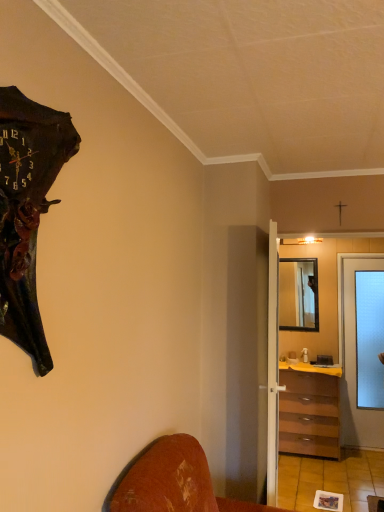
Question: Is transparent frosted glass screen door at center-right oriented towards wooden framed mirror at center?

Choices:
 (A) yes
 (B) no

Answer: (A)

Question: Would you say wooden framed mirror at center is part of transparent frosted glass screen door at center-right's contents?

Choices:
 (A) no
 (B) yes

Answer: (A)

Question: From the image's perspective, would you say transparent frosted glass screen door at center-right is positioned over wooden framed mirror at center?

Choices:
 (A) no
 (B) yes

Answer: (A)

Question: Can you confirm if transparent frosted glass screen door at center-right is thinner than wooden framed mirror at center?

Choices:
 (A) yes
 (B) no

Answer: (B)

Question: From a real-world perspective, does transparent frosted glass screen door at center-right sit lower than wooden framed mirror at center?

Choices:
 (A) no
 (B) yes

Answer: (B)

Question: Would you say yellow laminate counter top at center is to the left or to the right of brown wooden chest of drawers at center-right in the picture?

Choices:
 (A) left
 (B) right

Answer: (B)

Question: From a real-world perspective, relative to brown wooden chest of drawers at center-right, is yellow laminate counter top at center vertically above or below?

Choices:
 (A) below
 (B) above

Answer: (B)

Question: Considering the positions of yellow laminate counter top at center and brown wooden chest of drawers at center-right in the image, is yellow laminate counter top at center wider or thinner than brown wooden chest of drawers at center-right?

Choices:
 (A) thin
 (B) wide

Answer: (B)

Question: Does point (327, 369) appear closer or farther from the camera than point (337, 377)?

Choices:
 (A) closer
 (B) farther

Answer: (B)

Question: From a real-world perspective, is transparent glass door at right, acting as the first door starting from the right, positioned above or below dark brown wooden wall clock at left?

Choices:
 (A) above
 (B) below

Answer: (B)

Question: Would you say transparent glass door at right, acting as the first door starting from the right, is inside or outside dark brown wooden wall clock at left?

Choices:
 (A) outside
 (B) inside

Answer: (A)

Question: Is transparent glass door at right, the 1th door when ordered from back to front, to the left or to the right of dark brown wooden wall clock at left in the image?

Choices:
 (A) left
 (B) right

Answer: (B)

Question: In terms of height, does transparent glass door at right, the 1th door when ordered from back to front, look taller or shorter compared to dark brown wooden wall clock at left?

Choices:
 (A) short
 (B) tall

Answer: (B)

Question: Do you think yellow laminate counter top at center is within wooden framed mirror at center, or outside of it?

Choices:
 (A) outside
 (B) inside

Answer: (A)

Question: Is yellow laminate counter top at center in front of or behind wooden framed mirror at center in the image?

Choices:
 (A) front
 (B) behind

Answer: (A)